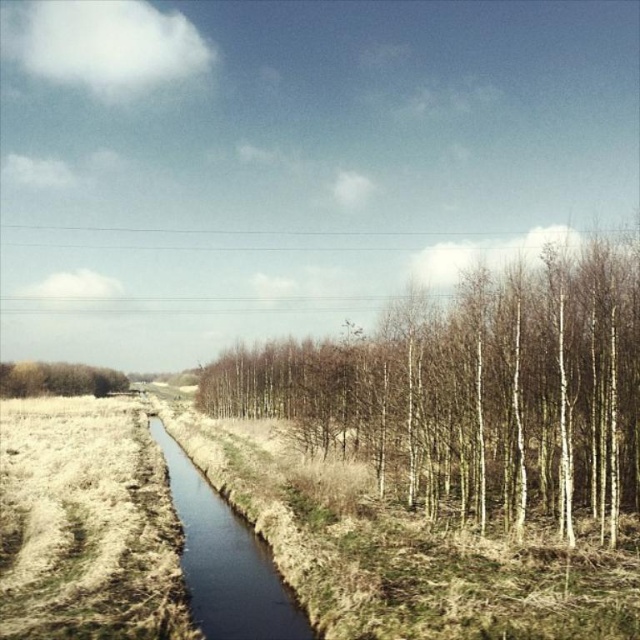
You are a hiker trying to cross the narrow waterway in the foreground. You notice the bare wood trees at center and the brown textured tree at left. Which tree group is closer to you as you stand at the edge of the waterway?

The bare wood trees at center are closer to you than the brown textured tree at left because they are positioned in front of it.

You are a hiker trying to cross the brown grassy stream at center and the brown textured tree at left. Which path would allow you to cross without getting your shoes wet?

The brown textured tree at left is narrower than the brown grassy stream at center, so crossing the brown textured tree at left would be drier.

You are standing in the rural landscape and want to walk from point A to point B. Point A is at coordinates point (422, 449) and point B is at coordinates point (186, 579). Which point is closer to you when you start walking?

Point A at coordinates point (422, 449) is closer to you because it is further to the viewer than point B at coordinates point (186, 579).